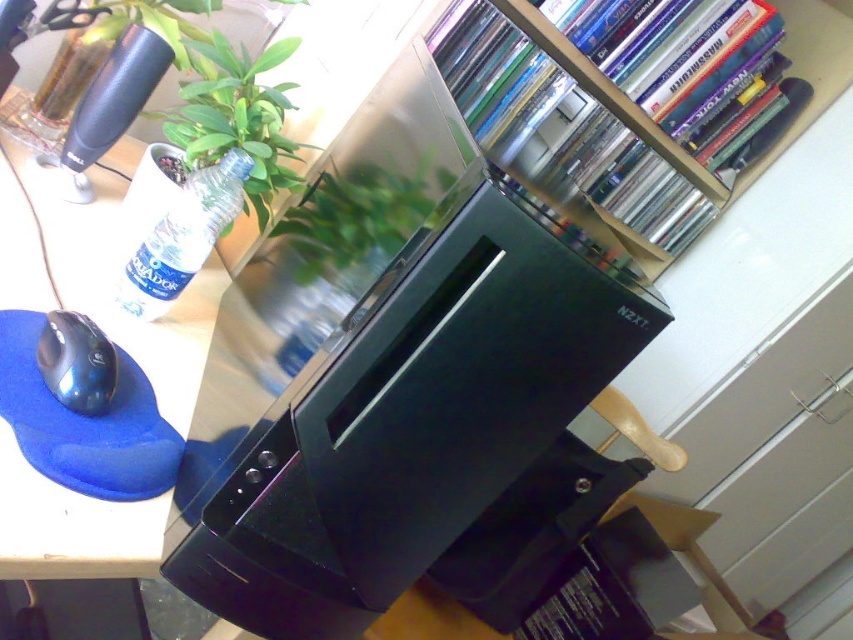
You are organizing your desk and want to place a new keyboard between the blue foam mousepad at lower left and the clear plastic bottle at upper left. Can the keyboard fit between them without overlapping either object?

The blue foam mousepad at lower left is in front of the clear plastic bottle at upper left, meaning there is space between them. However, the exact distance isn t specified, so it depends on the keyboard s size. If the keyboard is smaller than the gap between the two objects, it should fit without overlapping.

From the picture: You are looking at the workspace setup. There are two points marked on the desk surface. The first point is at coordinates point [339,333] and the second point is at point [90,369]. Which of these two points is closer to you?

Point [339,333] is closer to the viewer than point [90,369].

You are organizing your desk and need to place a 15 cm wide notebook between the blue foam mousepad at lower left and the clear plastic bottle at upper left. Will there be enough space for the notebook to fit between them?

The distance between the blue foam mousepad at lower left and the clear plastic bottle at upper left is 16.50 centimeters. Since the notebook is 15 cm wide, it will fit with 1.5 centimeters of space remaining.